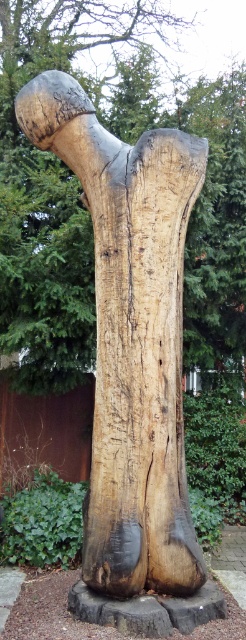
Question: Does natural wood sculpture at center have a larger size compared to natural wood tree trunk at center?

Choices:
 (A) no
 (B) yes

Answer: (A)

Question: Is natural wood sculpture at center smaller than natural wood tree trunk at center?

Choices:
 (A) yes
 (B) no

Answer: (A)

Question: Which point is farther from the camera taking this photo?

Choices:
 (A) (57, 301)
 (B) (134, 381)

Answer: (A)

Question: Which point appears farthest from the camera in this image?

Choices:
 (A) (11, 68)
 (B) (193, 536)

Answer: (A)

Question: Which of the following is the farthest from the observer?

Choices:
 (A) natural wood sculpture at center
 (B) natural wood tree trunk at center

Answer: (B)

Question: Is natural wood sculpture at center smaller than natural wood tree trunk at center?

Choices:
 (A) no
 (B) yes

Answer: (B)